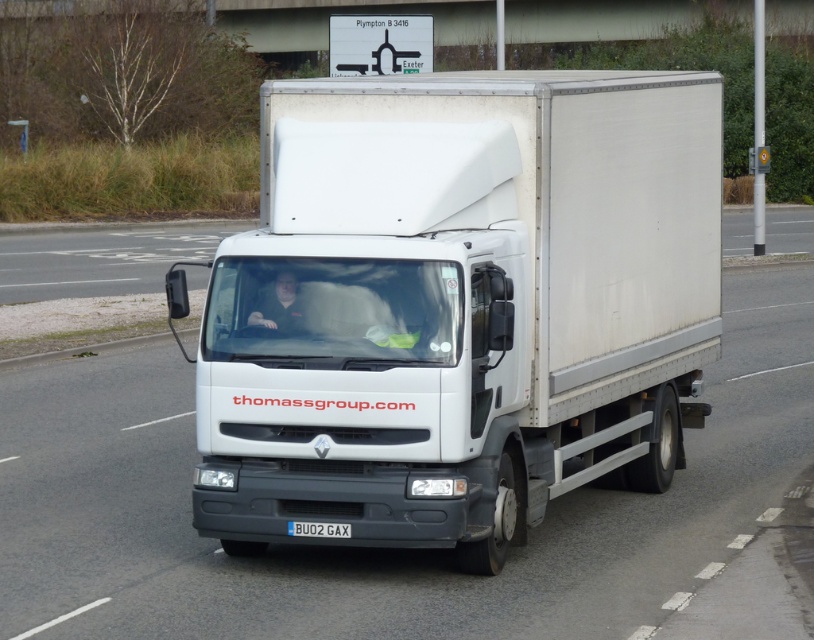
Question: Which object is farther from the camera taking this photo?

Choices:
 (A) black metal license plate at center
 (B) white matte truck at center
 (C) white glossy truck at center

Answer: (B)

Question: Which point appears farthest from the camera in this image?

Choices:
 (A) (191, 541)
 (B) (340, 456)
 (C) (292, 534)

Answer: (A)

Question: Is white matte truck at center bigger than white glossy truck at center?

Choices:
 (A) no
 (B) yes

Answer: (A)

Question: Does white matte truck at center come in front of black metal license plate at center?

Choices:
 (A) yes
 (B) no

Answer: (B)

Question: Is white matte truck at center closer to the viewer compared to black metal license plate at center?

Choices:
 (A) yes
 (B) no

Answer: (B)

Question: Which object is positioned farthest from the white matte truck at center?

Choices:
 (A) white glossy truck at center
 (B) black metal license plate at center

Answer: (A)